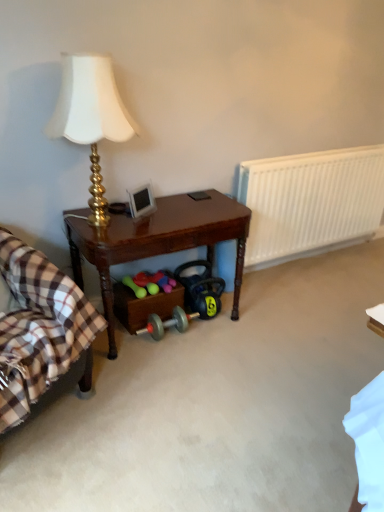
Question: Considering the relative sizes of white plastic radiator at right and gold metallic lamp at upper left in the image provided, is white plastic radiator at right bigger than gold metallic lamp at upper left?

Choices:
 (A) yes
 (B) no

Answer: (A)

Question: From a real-world perspective, does white plastic radiator at right stand above gold metallic lamp at upper left?

Choices:
 (A) no
 (B) yes

Answer: (A)

Question: Does white plastic radiator at right have a smaller size compared to gold metallic lamp at upper left?

Choices:
 (A) no
 (B) yes

Answer: (A)

Question: Is white plastic radiator at right oriented towards gold metallic lamp at upper left?

Choices:
 (A) yes
 (B) no

Answer: (B)

Question: Considering the relative sizes of white plastic radiator at right and gold metallic lamp at upper left in the image provided, is white plastic radiator at right wider than gold metallic lamp at upper left?

Choices:
 (A) no
 (B) yes

Answer: (A)

Question: Looking at the image, does brown wooden table at center seem bigger or smaller compared to white plastic radiator at right?

Choices:
 (A) big
 (B) small

Answer: (A)

Question: Visually, is brown wooden table at center positioned to the left or to the right of white plastic radiator at right?

Choices:
 (A) right
 (B) left

Answer: (B)

Question: Considering the positions of point (185, 231) and point (269, 210), is point (185, 231) closer or farther from the camera than point (269, 210)?

Choices:
 (A) closer
 (B) farther

Answer: (A)

Question: Choose the correct answer: Is brown wooden table at center inside white plastic radiator at right or outside it?

Choices:
 (A) inside
 (B) outside

Answer: (B)

Question: Is gold metallic lamp at upper left in front of or behind white plastic radiator at right in the image?

Choices:
 (A) front
 (B) behind

Answer: (A)

Question: From the image's perspective, is gold metallic lamp at upper left above or below white plastic radiator at right?

Choices:
 (A) below
 (B) above

Answer: (B)

Question: Considering the positions of gold metallic lamp at upper left and white plastic radiator at right in the image, is gold metallic lamp at upper left bigger or smaller than white plastic radiator at right?

Choices:
 (A) small
 (B) big

Answer: (A)

Question: Looking at their shapes, would you say gold metallic lamp at upper left is wider or thinner than white plastic radiator at right?

Choices:
 (A) wide
 (B) thin

Answer: (A)

Question: Is plaid fabric at left to the left or to the right of brown wooden table at center in the image?

Choices:
 (A) left
 (B) right

Answer: (A)

Question: Is plaid fabric at left bigger or smaller than brown wooden table at center?

Choices:
 (A) big
 (B) small

Answer: (A)